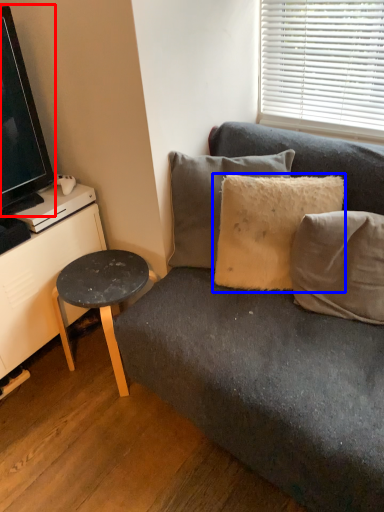
Question: Which of the following is the farthest to the observer, television (highlighted by a red box) or pillow (highlighted by a blue box)?

Choices:
 (A) television
 (B) pillow

Answer: (B)